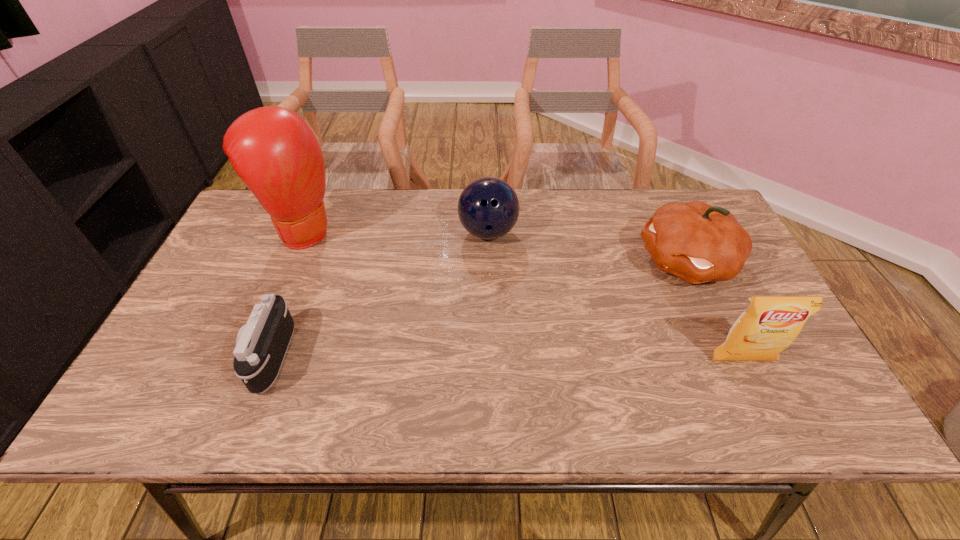
Locate an element on the screen. The height and width of the screenshot is (540, 960). free space at the left edge of the desktop is located at coordinates (206, 288).

Image resolution: width=960 pixels, height=540 pixels. What are the coordinates of `vacant space at the near left corner of the desktop` in the screenshot? It's located at (180, 384).

Locate an element on the screen. Image resolution: width=960 pixels, height=540 pixels. vacant space at the near right corner is located at coordinates (760, 367).

Where is `vacant region between the shortest object and the boxing glove`? This screenshot has height=540, width=960. vacant region between the shortest object and the boxing glove is located at coordinates (287, 293).

This screenshot has width=960, height=540. Find the location of `vacant space that's between the bowling ball and the pumpkin`. vacant space that's between the bowling ball and the pumpkin is located at coordinates (587, 247).

This screenshot has width=960, height=540. In order to click on unoccupied position between the bowling ball and the shortest object in this screenshot , I will do `click(379, 294)`.

You are a GUI agent. You are given a task and a screenshot of the screen. Output one action in this format:
    pyautogui.click(x=<x>, y=<y>)
    Task: Click on the vacant space that's between the tallest object and the second shortest object
    This screenshot has height=540, width=960.
    Given the screenshot: What is the action you would take?
    pyautogui.click(x=396, y=231)

At what (x,y) coordinates should I click in order to perform the action: click on free space between the bowling ball and the pumpkin. Please return your answer as a coordinate pair (x, y). This screenshot has width=960, height=540. Looking at the image, I should click on (587, 247).

This screenshot has width=960, height=540. I want to click on free space between the pumpkin and the tallest object, so click(495, 246).

This screenshot has height=540, width=960. Find the location of `vacant point located between the pumpkin and the crisp (potato chip)`. vacant point located between the pumpkin and the crisp (potato chip) is located at coordinates (713, 311).